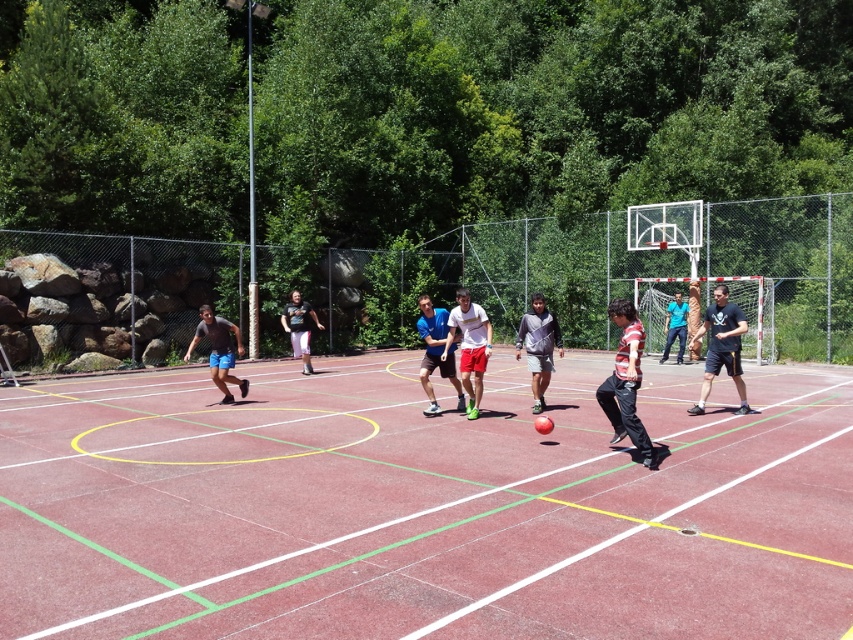
You are standing at the point with coordinates point (730, 344) and want to walk towards the point with coordinates point (514, 627). Which direction should you move?

You should move forward because point (514, 627) is in front of point (730, 344).

You are a photographer positioned at the edge of the red rubber basketball court at center and want to take a photo of the gray fleece jacket at center. Which direction should you move to frame the jacket in your shot?

The red rubber basketball court at center is to the left of the gray fleece jacket at center. To frame the jacket in your shot, you should move to the right side of the court.